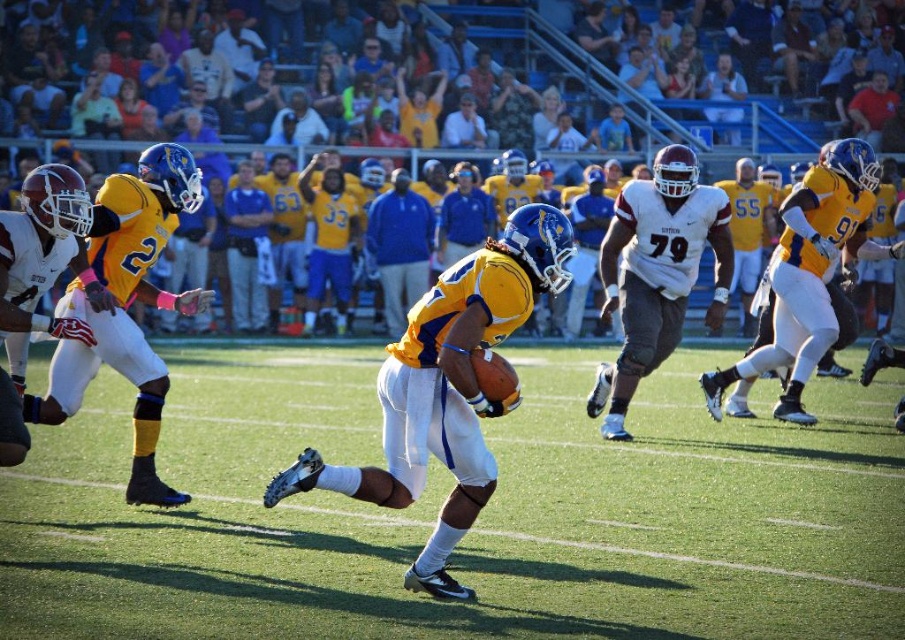
You are a football coach analyzing the field layout. You notice the green grass football field at center and the yellow matte jersey at center. Which object occupies more horizontal space in the image?

The green grass football field at center has a larger width than the yellow matte jersey at center, so it occupies more horizontal space.